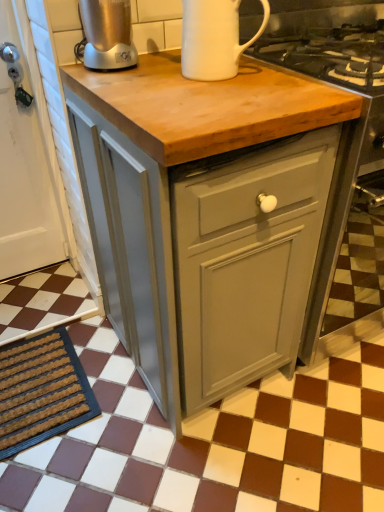
Find the location of a particular element. free space in front of matte gray cabinet at center is located at coordinates (197, 460).